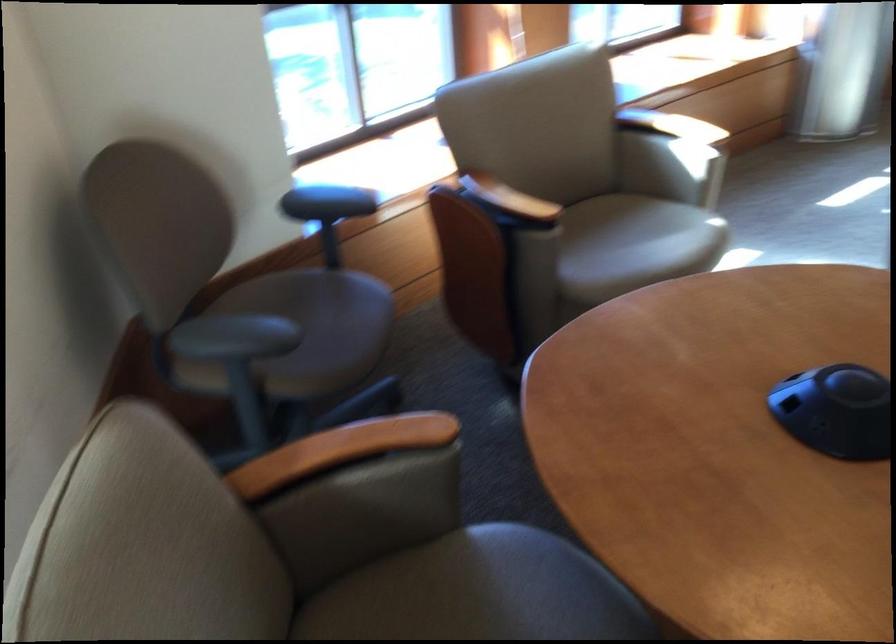
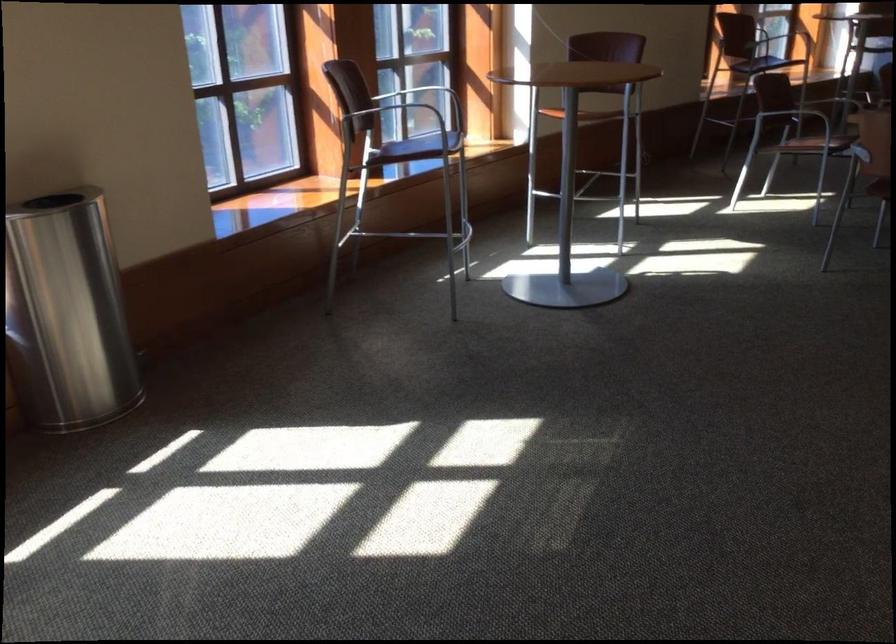
Question: The images are taken continuously from a first-person perspective. In which direction are you moving?

Choices:
 (A) Left
 (B) Right
 (C) Forward
 (D) Backward

Answer: (B)